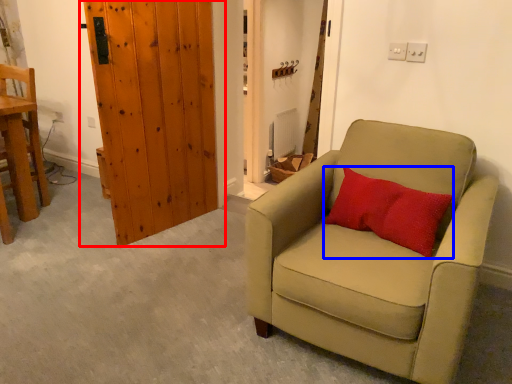
Question: Which of the following is the farthest to the observer, door (highlighted by a red box) or pillow (highlighted by a blue box)?

Choices:
 (A) door
 (B) pillow

Answer: (A)